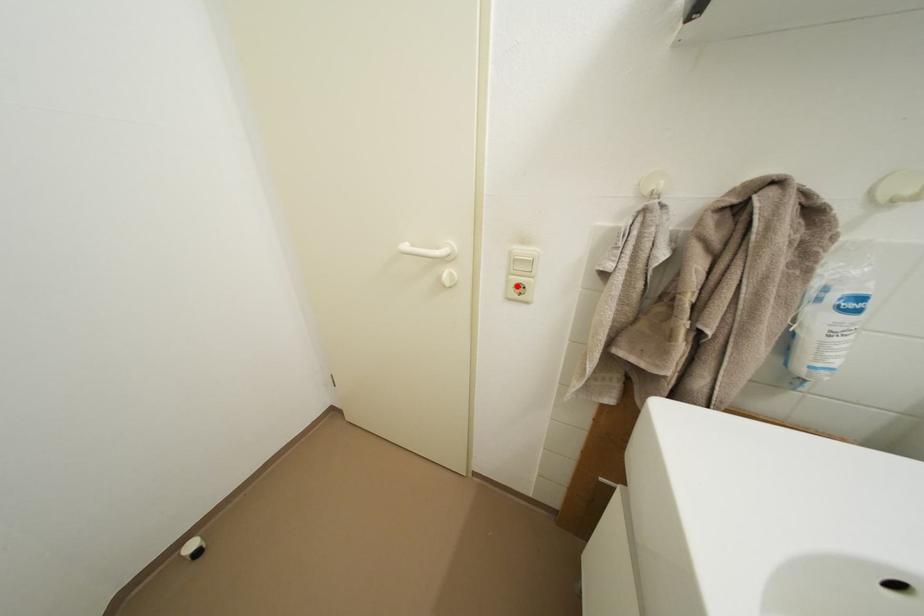
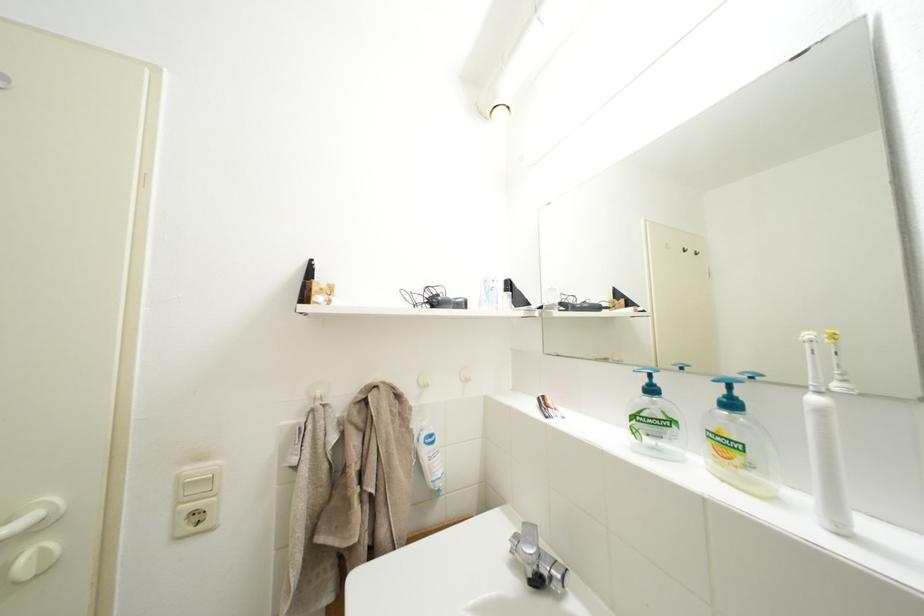
Where in the second image is the point corresponding to the highlighted location from the first image?

(185, 519)